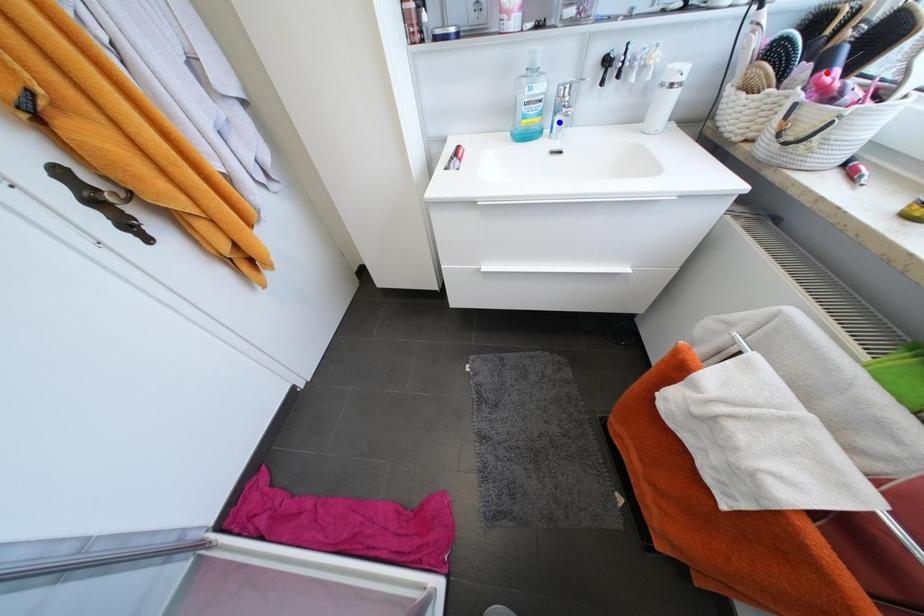
Question: Two points are marked on the image. Which point is closer to the camera?

Choices:
 (A) Blue point is closer.
 (B) Red point is closer.

Answer: (B)